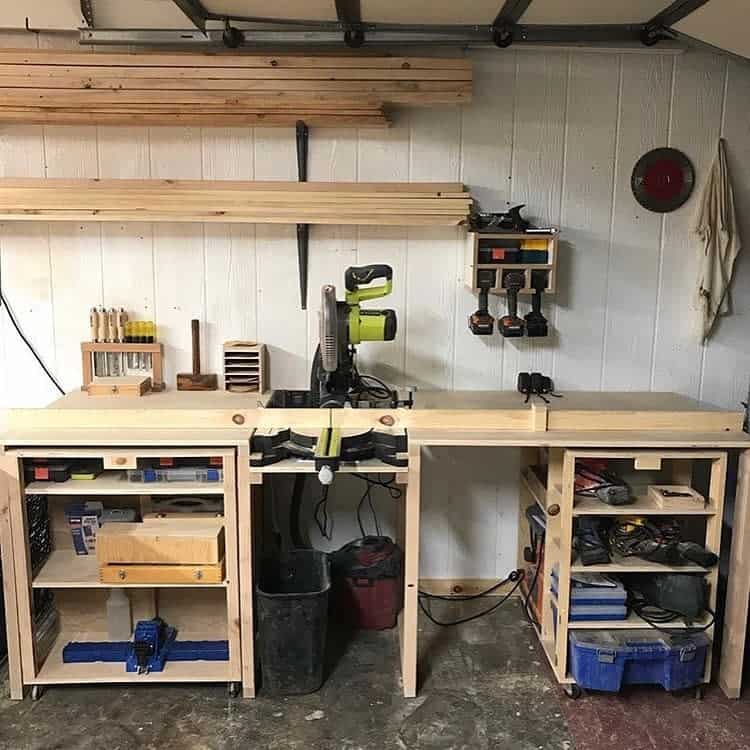
This screenshot has width=750, height=750. I want to click on shelf bracket, so click(301, 156).